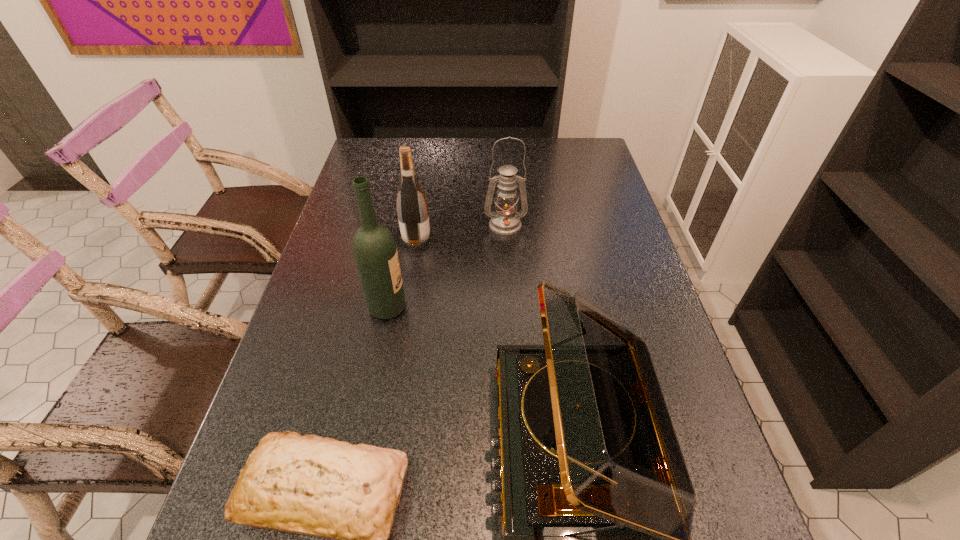
This screenshot has height=540, width=960. I want to click on the tallest object, so click(x=375, y=252).

Find the location of a particular element. the taller wine bottle is located at coordinates (375, 252).

The image size is (960, 540). Identify the location of the farther wine bottle. (412, 209).

Where is `oil lamp`? The width and height of the screenshot is (960, 540). oil lamp is located at coordinates (505, 221).

The image size is (960, 540). What are the coordinates of `vacant space located 0.310m on the labeled side of the nearer wine bottle` in the screenshot? It's located at (529, 308).

At what (x,y) coordinates should I click in order to perform the action: click on free space located on the label of the farther wine bottle. Please return your answer as a coordinate pair (x, y). Image resolution: width=960 pixels, height=540 pixels. Looking at the image, I should click on (557, 241).

I want to click on free space located 0.090m on the right of the oil lamp, so click(556, 225).

In the image, there is a desktop. Identify the location of free space at the far edge. (451, 159).

The width and height of the screenshot is (960, 540). Find the location of `free space at the left edge of the desktop`. free space at the left edge of the desktop is located at coordinates (332, 240).

Identify the location of vacant space at the right edge of the desktop. (643, 265).